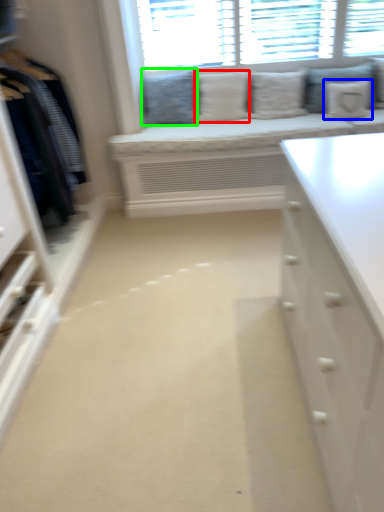
Question: Estimate the real-world distances between objects in this image. Which object is farther from pillow (highlighted by a red box), pillow (highlighted by a blue box) or pillow (highlighted by a green box)?

Choices:
 (A) pillow
 (B) pillow

Answer: (A)